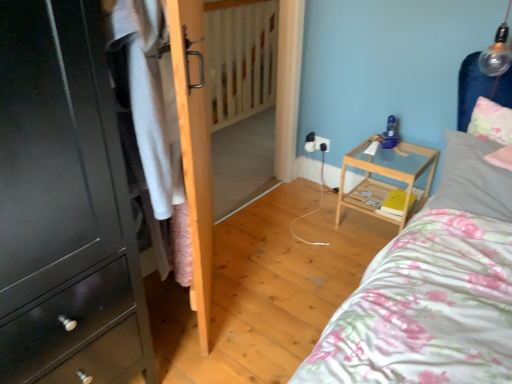
Identify the location of vacant space behind wooden door at left. Image resolution: width=512 pixels, height=384 pixels. (257, 238).